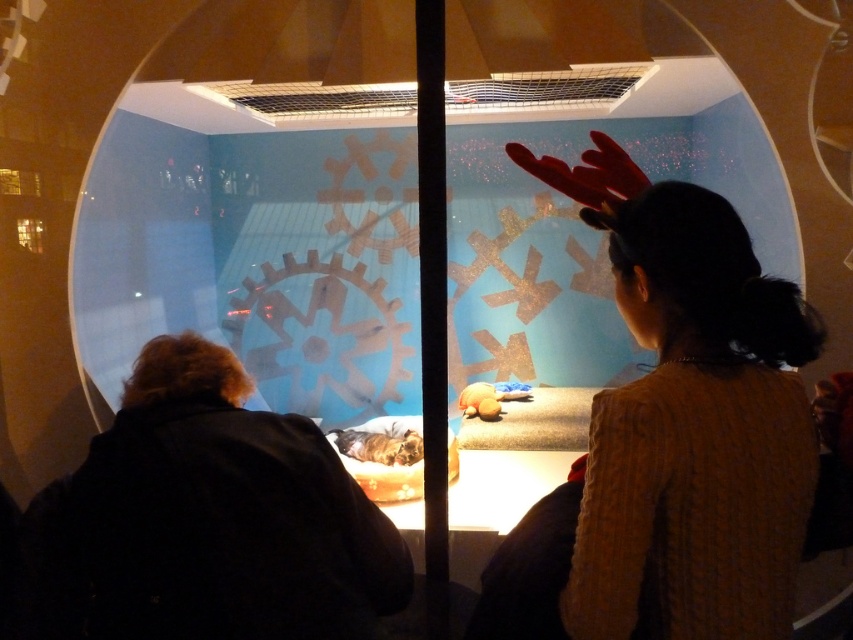
You are a photographer trying to capture a closeup of the knitted sweater at upper right without getting too close to the camera. What is the minimum distance you need to maintain between yourself and the camera to ensure you can still get a clear shot of the sweater?

The knitted sweater at upper right and camera are 87.28 centimeters apart. To capture a clear shot of the knitted sweater at upper right while maintaining the required distance from the camera, you should stay at least 87.28 centimeters away from the camera.

You are standing in front of a display case in a museum. There is a point marked at coordinates point (602, 419). If you want to touch that point with a ruler that is 36 inches long, can you reach it?

The distance between point (602, 419) and the viewer is 36.85 inches. Since the ruler is only 36 inches long, it is 0.85 inches too short to reach the point.

You are an assistant in the museum and need to retrieve both the knitted sweater at upper right and the rubber glove at upper center from the display case. Which object should you remove first to access the other without disturbing the setup?

You should remove the rubber glove at upper center first because the knitted sweater at upper right is positioned under it, so removing the glove first will allow access to the sweater without disturbing the setup.